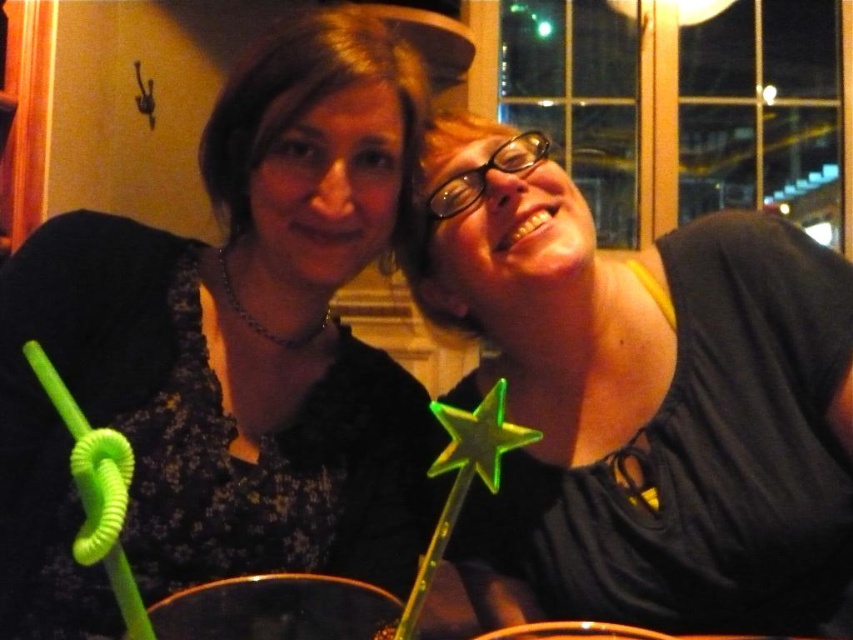
Based on the photo, you are at a party and want to grab a drink. You see the translucent glass beverage at lower center and the green plastic star at center. Which object is shorter?

The translucent glass beverage at lower center is shorter than the green plastic star at center.

You are at a party and want to retrieve the green plastic star at center from under the matte black dress at left. Is it possible to reach it without moving the dress?

The matte black dress at left is positioned over the green plastic star at center, so you would need to move the dress to access the star.